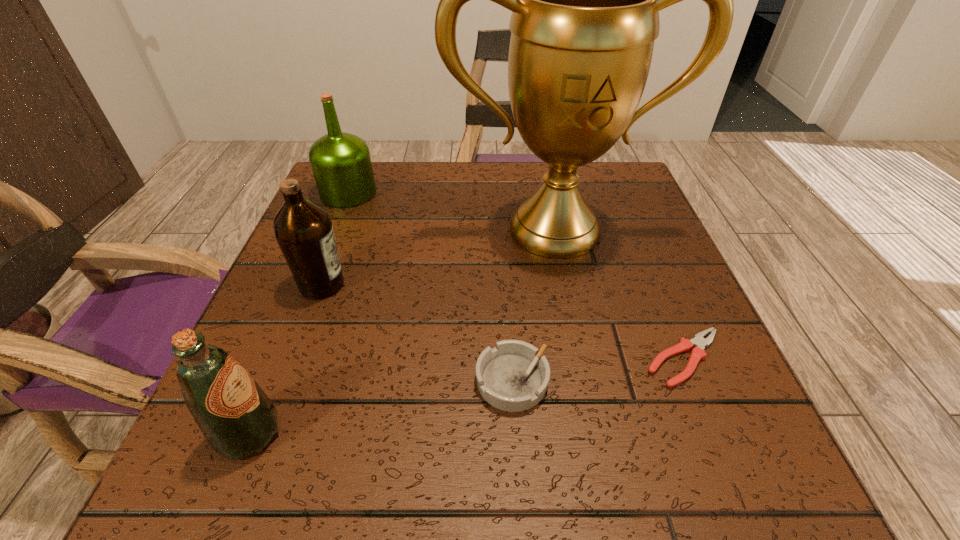
The image size is (960, 540). Identify the location of free spot located on the back of the ashtray. pos(506,275).

You are a GUI agent. You are given a task and a screenshot of the screen. Output one action in this format:
    pyautogui.click(x=<x>, y=<y>)
    Task: Click on the vacant space situated 0.120m on the left of the pliers
    The width and height of the screenshot is (960, 540).
    Given the screenshot: What is the action you would take?
    (x=566, y=359)

I want to click on trophy cup at the far edge, so click(x=585, y=0).

This screenshot has height=540, width=960. I want to click on olive oil present at the far edge, so click(341, 164).

The width and height of the screenshot is (960, 540). What are the coordinates of `object present at the near edge` in the screenshot? It's located at (236, 417).

In order to click on trophy cup that is positioned at the right edge in this screenshot , I will do `click(585, 0)`.

Find the location of a particular element. pliers positioned at the right edge is located at coordinates (698, 353).

Locate an element on the screen. This screenshot has width=960, height=540. object that is at the far left corner is located at coordinates (341, 164).

You are a GUI agent. You are given a task and a screenshot of the screen. Output one action in this format:
    pyautogui.click(x=<x>, y=<y>)
    Task: Click on the object situated at the near left corner
    
    Given the screenshot: What is the action you would take?
    pyautogui.click(x=236, y=417)

Identify the location of object that is at the far right corner. The height and width of the screenshot is (540, 960). (585, 0).